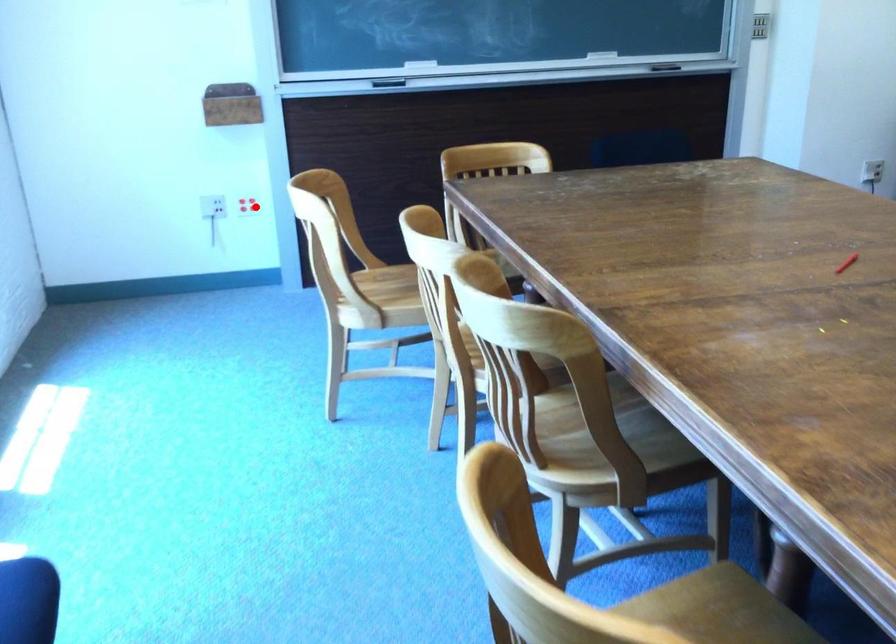
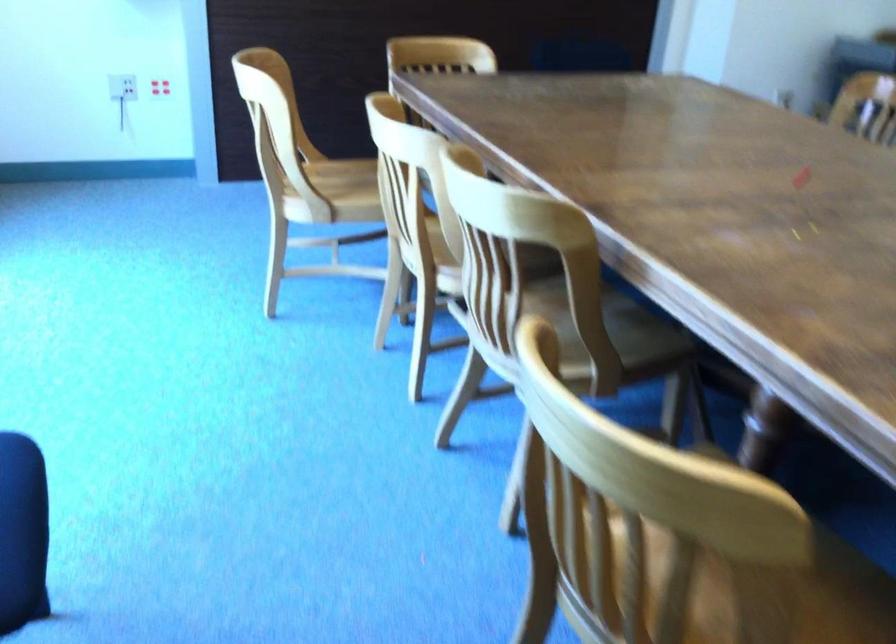
Question: I am providing you with two images of the same scene from different viewpoints. A red point is shown in image1. For the corresponding object point in image2, is it positioned nearer or farther from the camera?

Choices:
 (A) Nearer
 (B) Farther

Answer: (A)